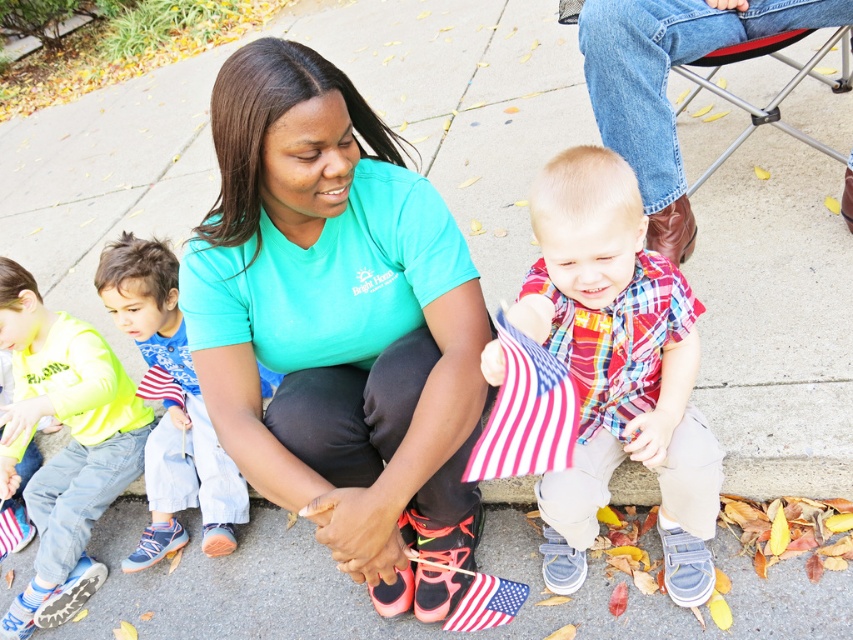
You are standing at the camera position and want to reach both the point at (698,445) and the point at (21,396). Which point will you reach first?

You will reach point (698,445) first because it is closer to the camera than point (21,396).

You are at an outdoor event and see two people wearing shirts of different colors. The teal matte shirt at center and the neon yellow shirt at left. Which one is positioned more to the right side?

The teal matte shirt at center is positioned more to the right side than the neon yellow shirt at left.